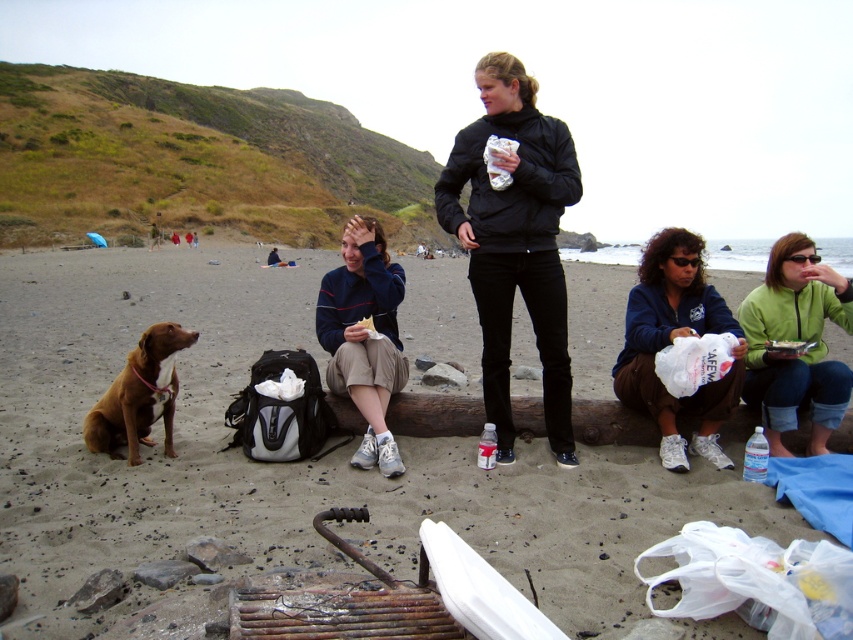
From the picture: You are standing at the point with coordinates point (515, 241). What object is located at that position?

The point (515, 241) corresponds to the black matte jacket at center.

Looking at this image, you are standing at the beach and want to place a small flag exactly halfway between the two points marked as point 1 and point 2. Given that point 1 is at coordinates point (467, 236) and point 2 is at coordinates point (105, 400), where should you place the flag?

The flag should be placed at the midpoint between the two points. To calculate the midpoint, average the x and y coordinates of both points. The midpoint would be at coordinates point 0.4975, 0.3365.

You are organizing a beach cleanup and need to collect items from the black matte jacket at center and the blue fleece jacket at lower right. Which jacket is positioned to the right side of the other?

The blue fleece jacket at lower right is to the right of the black matte jacket at center.